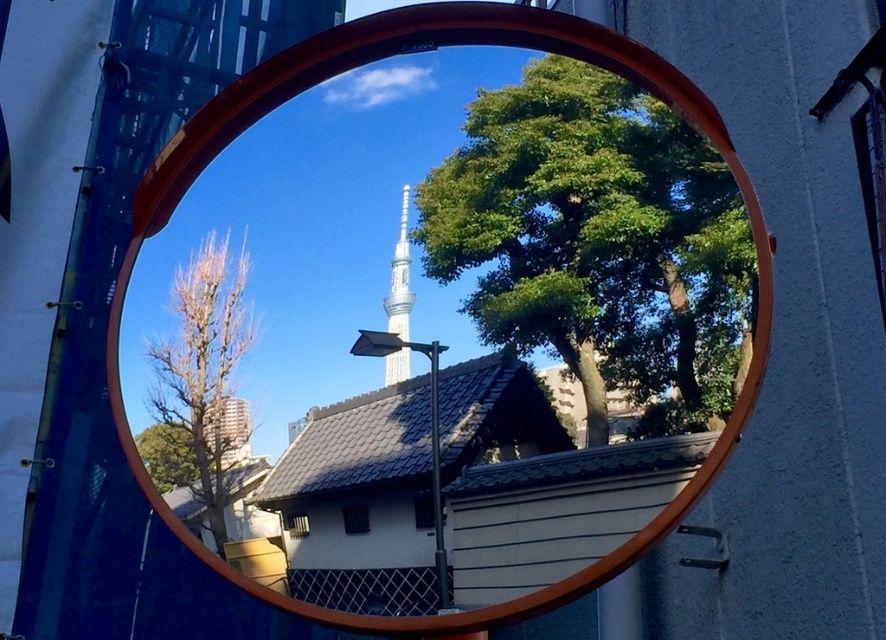
You are an architect designing a new building and want to ensure it won not block the view of the shiny silver tower at center from the green leafy tree at upper center. Based on the scene, which object has a wider visual footprint that might require more consideration in your design?

The green leafy tree at upper center has a larger width than the shiny silver tower at center, so it has a wider visual footprint and requires more consideration in the design to ensure the view of the shiny silver tower at center remains unobstructed.